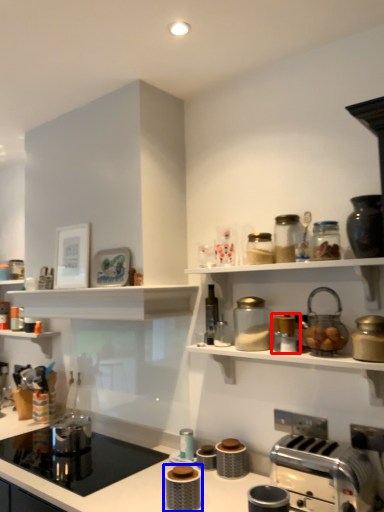
Question: Which point is closer to the camera, appliance (highlighted by a red box) or appliance (highlighted by a blue box)?

Choices:
 (A) appliance
 (B) appliance

Answer: (B)